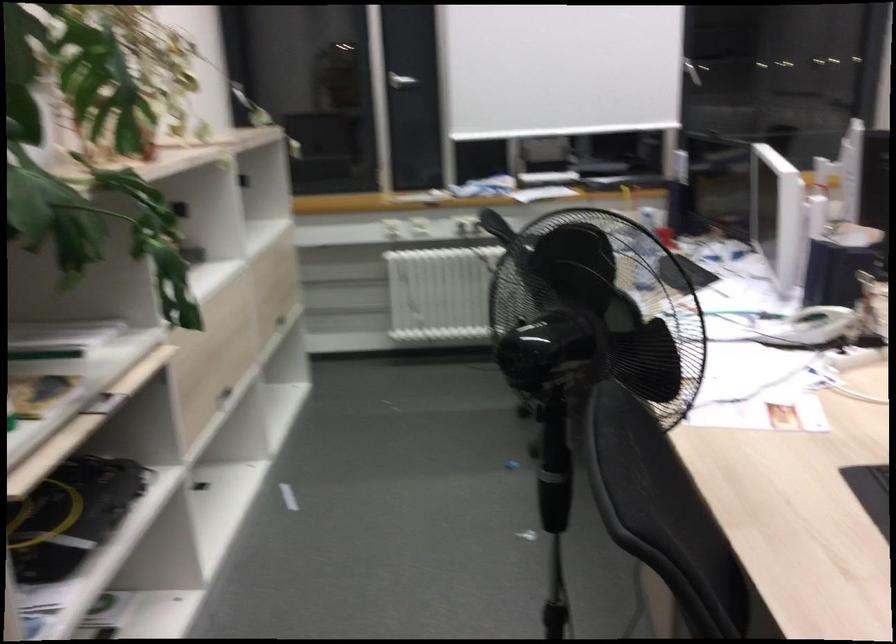
Identify the location of white telephone handset. (811, 327).